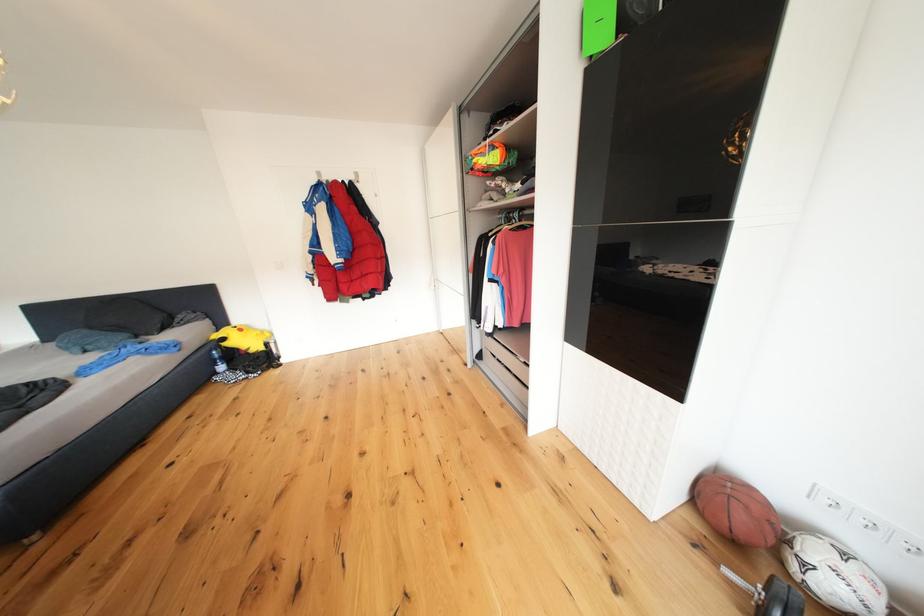
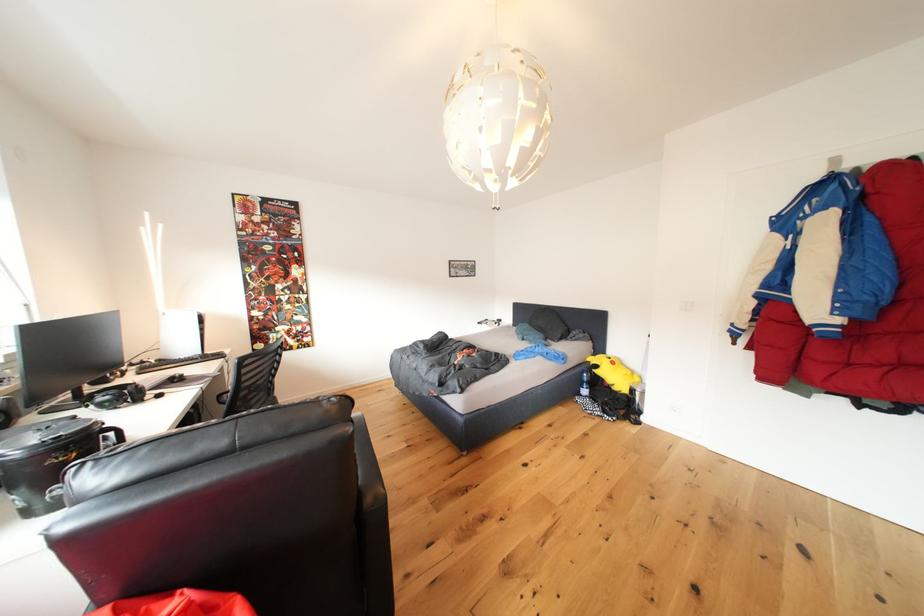
Question: Based on the continuous images, in which direction is the camera rotating? Reply with the corresponding letter.

Choices:
 (A) Left
 (B) Right
 (C) Up
 (D) Down

Answer: (A)